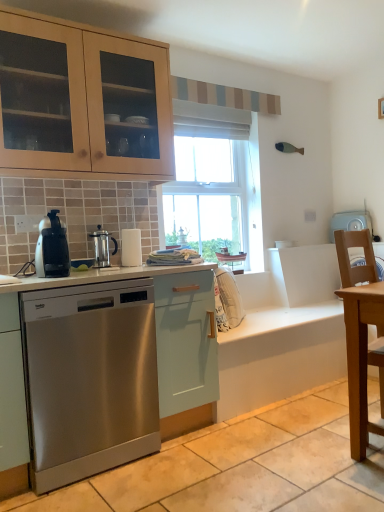
Question: Can you confirm if light brown wooden table at right is bigger than satin black coffee maker at left?

Choices:
 (A) yes
 (B) no

Answer: (A)

Question: Is light brown wooden table at right oriented away from satin black coffee maker at left?

Choices:
 (A) yes
 (B) no

Answer: (B)

Question: Would you say light brown wooden table at right contains satin black coffee maker at left?

Choices:
 (A) no
 (B) yes

Answer: (A)

Question: Considering the relative positions of light brown wooden table at right and satin black coffee maker at left in the image provided, is light brown wooden table at right to the left of satin black coffee maker at left from the viewer's perspective?

Choices:
 (A) yes
 (B) no

Answer: (B)

Question: Is light brown wooden table at right placed right next to satin black coffee maker at left?

Choices:
 (A) yes
 (B) no

Answer: (B)

Question: From a real-world perspective, relative to stainless steel dishwasher at left, is satin silver coffee press at center vertically above or below?

Choices:
 (A) above
 (B) below

Answer: (A)

Question: Does point (96, 253) appear closer or farther from the camera than point (215, 355)?

Choices:
 (A) closer
 (B) farther

Answer: (B)

Question: Is satin silver coffee press at center wider or thinner than stainless steel dishwasher at left?

Choices:
 (A) wide
 (B) thin

Answer: (B)

Question: Considering the positions of satin silver coffee press at center and stainless steel dishwasher at left in the image, is satin silver coffee press at center taller or shorter than stainless steel dishwasher at left?

Choices:
 (A) short
 (B) tall

Answer: (A)

Question: In terms of width, does light blue plastic washing machine at right look wider or thinner when compared to light brown wooden table at right?

Choices:
 (A) wide
 (B) thin

Answer: (B)

Question: From the image's perspective, is light blue plastic washing machine at right positioned above or below light brown wooden table at right?

Choices:
 (A) below
 (B) above

Answer: (B)

Question: Is light blue plastic washing machine at right taller or shorter than light brown wooden table at right?

Choices:
 (A) short
 (B) tall

Answer: (A)

Question: Does point (359, 228) appear closer or farther from the camera than point (357, 411)?

Choices:
 (A) closer
 (B) farther

Answer: (B)

Question: Would you say satin black coffee maker at left is inside or outside satin silver coffee press at center?

Choices:
 (A) inside
 (B) outside

Answer: (B)

Question: Considering the relative positions of satin black coffee maker at left and satin silver coffee press at center in the image provided, is satin black coffee maker at left to the left or to the right of satin silver coffee press at center?

Choices:
 (A) left
 (B) right

Answer: (A)